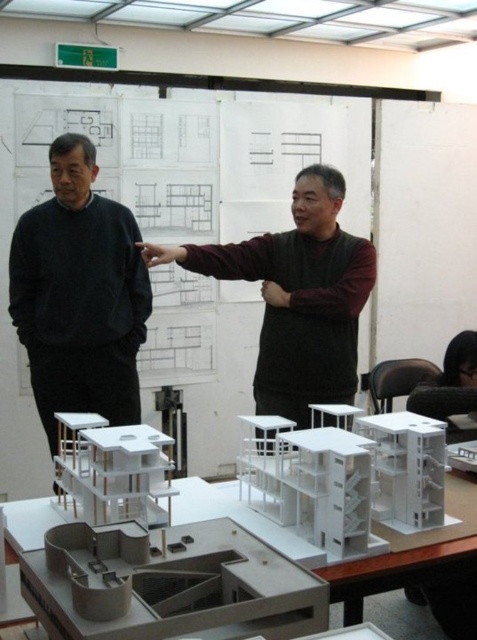
You are an architect trying to place a 1.2 meter wide blueprint on the white matte table at center. The black matte sweater at left is currently occupying some space. Can the blueprint fit on the table if you move the sweater?

The black matte sweater at left has a lesser width compared to white matte table at center. Therefore, moving the sweater would free up enough space for the 1.2 meter wide blueprint to fit on the white matte table at center.

You are an architect standing at the entrance of the studio. You need to locate the black matte sweater at left. According to the studio layout, where would you find it?

The black matte sweater at left is located at point (80, 294) in the studio layout.

You are an observer in the studio. You see the black matte sweater at left and the dark brown sweater at center. Which sweater takes up less horizontal space?

The black matte sweater at left has a lesser width compared to the dark brown sweater at center, so it takes up less horizontal space.